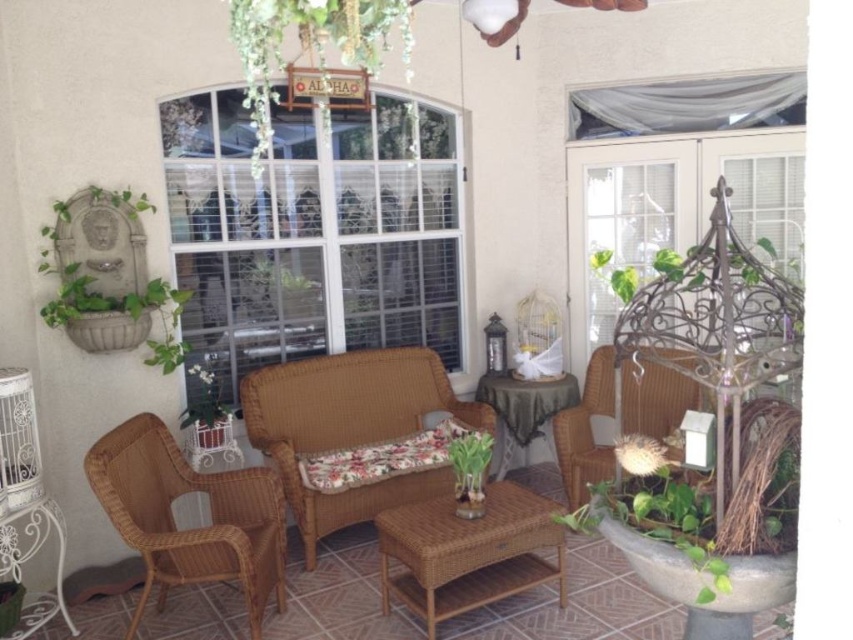
Who is shorter, green leafy plant at lower right or green wicker basket at lower left?

green wicker basket at lower left

Is point (625, 461) in front of point (212, 369)?

That is True.

At what (x,y) coordinates should I click in order to perform the action: click on green leafy plant at lower right. Please return your answer as a coordinate pair (x, y). The width and height of the screenshot is (853, 640). Looking at the image, I should click on (656, 508).

Can you confirm if green leafy plant at upper center is bigger than green wicker basket at lower left?

Indeed, green leafy plant at upper center has a larger size compared to green wicker basket at lower left.

At what (x,y) coordinates should I click in order to perform the action: click on green leafy plant at upper center. Please return your answer as a coordinate pair (x, y). Looking at the image, I should click on (311, 48).

Who is taller, woven rattan armchair at center or green leafy plant at upper center?

woven rattan armchair at center is taller.

Does woven rattan armchair at center appear on the right side of green leafy plant at upper center?

In fact, woven rattan armchair at center is to the left of green leafy plant at upper center.

Who is more distant from viewer, (434,380) or (305,19)?

Point (434,380)

Where is `woven rattan armchair at center`? woven rattan armchair at center is located at coordinates (350, 428).